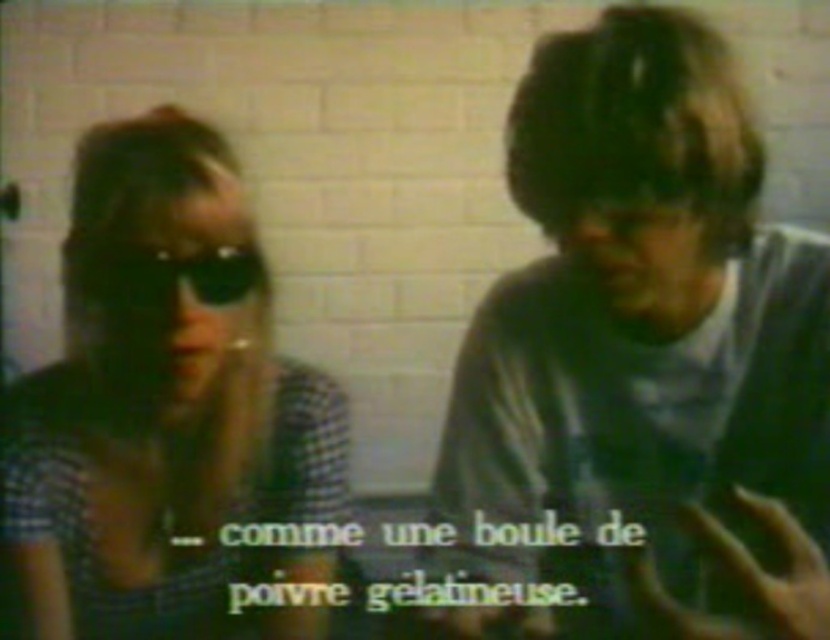
Question: Which of the following is the closest to the observer?

Choices:
 (A) checkered fabric shirt at left
 (B) black rubber goggles at upper left
 (C) matte gray shirt at center

Answer: (C)

Question: Which point is closer to the camera?

Choices:
 (A) matte gray shirt at center
 (B) black rubber goggles at upper left

Answer: (A)

Question: Estimate the real-world distances between objects in this image. Which object is farther from the checkered fabric shirt at left?

Choices:
 (A) matte gray shirt at center
 (B) black rubber goggles at upper left

Answer: (A)

Question: Does matte gray shirt at center appear on the right side of checkered fabric shirt at left?

Choices:
 (A) yes
 (B) no

Answer: (A)

Question: Is matte gray shirt at center positioned in front of black rubber goggles at upper left?

Choices:
 (A) no
 (B) yes

Answer: (B)

Question: Does matte gray shirt at center have a lesser width compared to checkered fabric shirt at left?

Choices:
 (A) no
 (B) yes

Answer: (A)